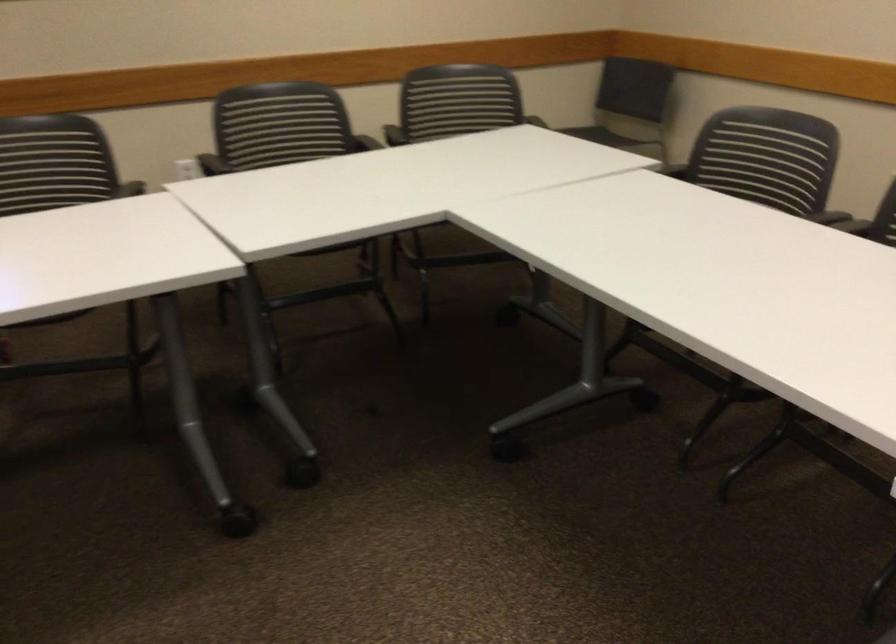
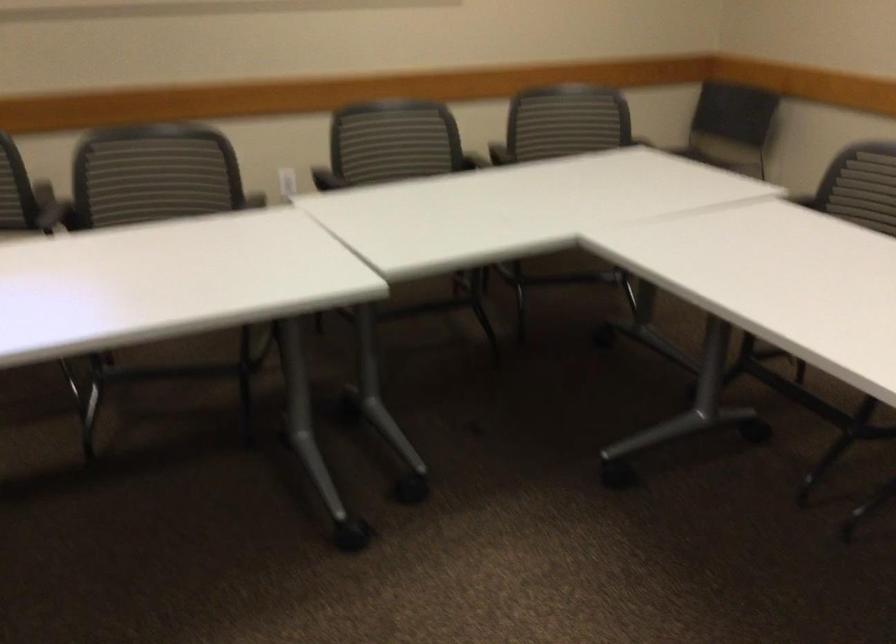
Question: I am providing you with two images of the same scene from different viewpoints. Please identify which objects are invisible in image2.

Choices:
 (A) chair sitting surface
 (B) small drawer pull
 (C) chair armrest
 (D) black chair armrest

Answer: (D)